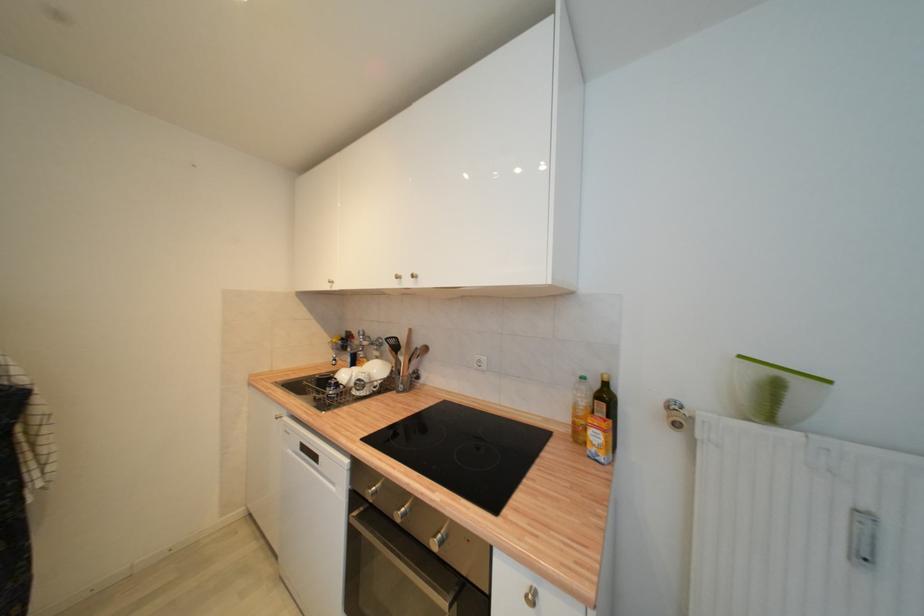
Where is `wooden utensil`? The image size is (924, 616). wooden utensil is located at coordinates [x=417, y=358].